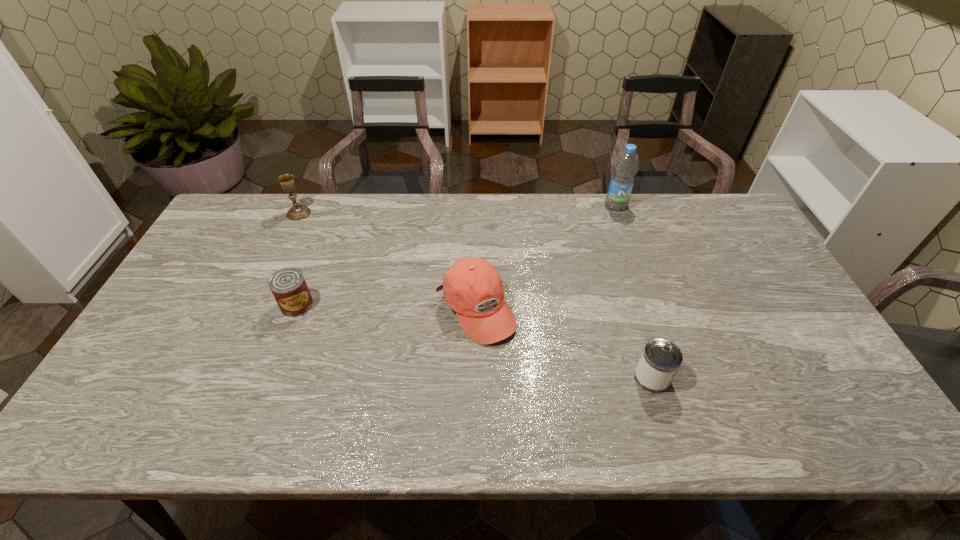
This screenshot has height=540, width=960. I want to click on blank area in the image that satisfies the following two spatial constraints: 1. on the back side of the left can; 2. on the right side of the water bottle, so click(335, 205).